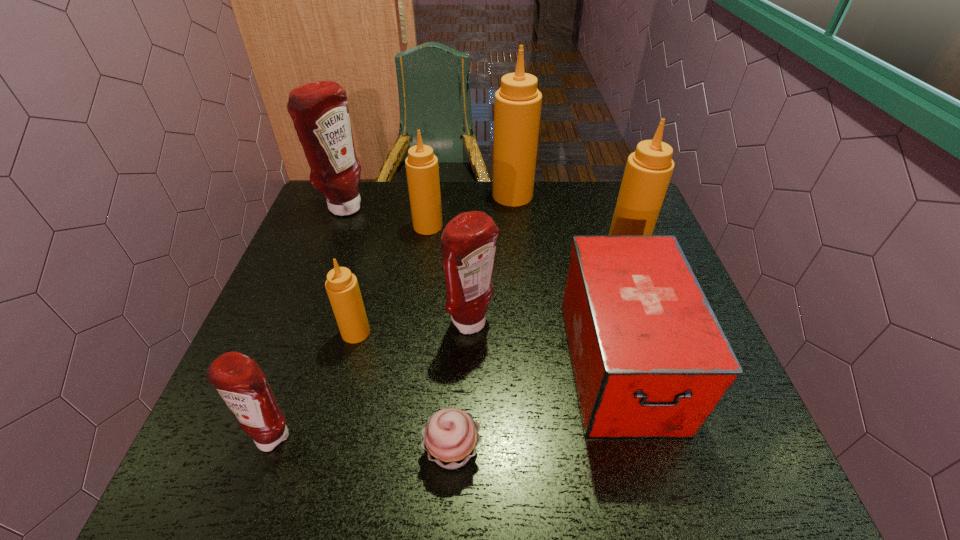
What are the coordinates of `the smallest tan condiment` in the screenshot? It's located at (342, 287).

Locate an element on the screen. This screenshot has width=960, height=540. the nearest red condiment is located at coordinates (241, 383).

Image resolution: width=960 pixels, height=540 pixels. In order to click on the smallest red condiment in this screenshot , I will do `click(241, 383)`.

This screenshot has width=960, height=540. I want to click on the first-aid kit, so click(x=650, y=360).

Identify the location of pink cupcake. Image resolution: width=960 pixels, height=540 pixels. (450, 437).

Where is `cupcake`? cupcake is located at coordinates (450, 437).

Where is `free location located on the front of the sixth condiment from left to right`? The width and height of the screenshot is (960, 540). free location located on the front of the sixth condiment from left to right is located at coordinates (516, 239).

This screenshot has width=960, height=540. I want to click on vacant space located 0.200m on the right of the biggest red condiment, so (x=430, y=207).

You are a GUI agent. You are given a task and a screenshot of the screen. Output one action in this format:
    pyautogui.click(x=<x>, y=<y>)
    Task: Click on the vacant point located 0.050m on the front of the rightmost condiment
    
    Given the screenshot: What is the action you would take?
    pyautogui.click(x=636, y=274)

The width and height of the screenshot is (960, 540). I want to click on free space located 0.300m on the left of the third nearest tan condiment, so click(312, 226).